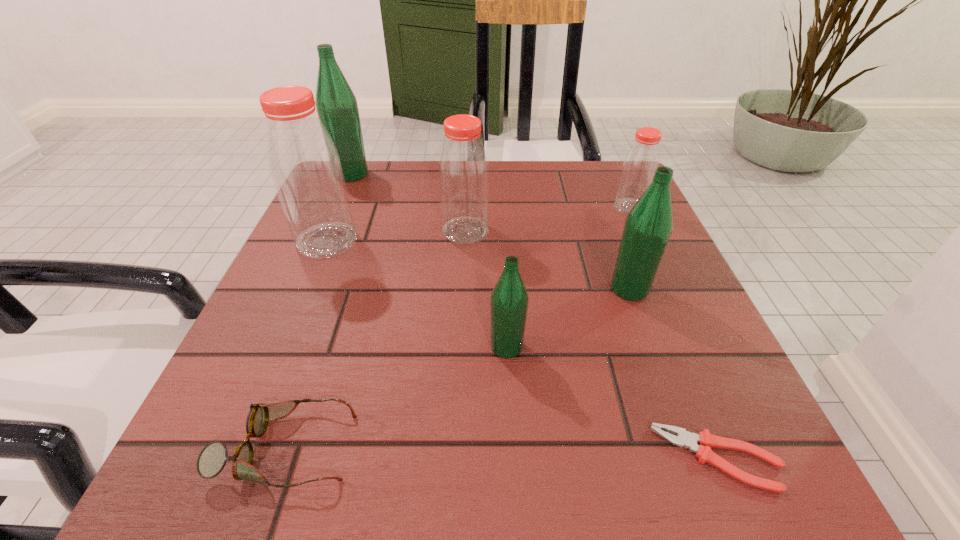
Find the location of `the leftmost green bottle`. the leftmost green bottle is located at coordinates (337, 108).

At what (x,y) coordinates should I click in order to perform the action: click on the biggest green bottle. Please return your answer as a coordinate pair (x, y). Looking at the image, I should click on (337, 108).

Identify the location of the leftmost red bottle. (305, 167).

Find the location of `the fourth nearest object`. the fourth nearest object is located at coordinates (648, 226).

Where is `the second nearest green bottle`? This screenshot has width=960, height=540. the second nearest green bottle is located at coordinates (648, 226).

Where is `the second biggest red bottle`? This screenshot has height=540, width=960. the second biggest red bottle is located at coordinates (463, 171).

Where is `the farthest red bottle`? the farthest red bottle is located at coordinates (639, 165).

Locate an element on the screen. Image resolution: width=960 pixels, height=540 pixels. the second farthest object is located at coordinates (639, 165).

I want to click on the second green bottle from left to right, so tap(509, 300).

The width and height of the screenshot is (960, 540). What are the coordinates of `the nearest bottle` in the screenshot? It's located at (509, 300).